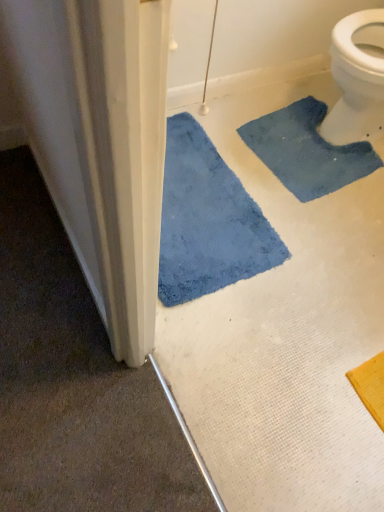
Locate an element on the screen. The width and height of the screenshot is (384, 512). spots to the right of blue plush bath mat at lower left, which ranks as the second bath mat in right-to-left order is located at coordinates (317, 266).